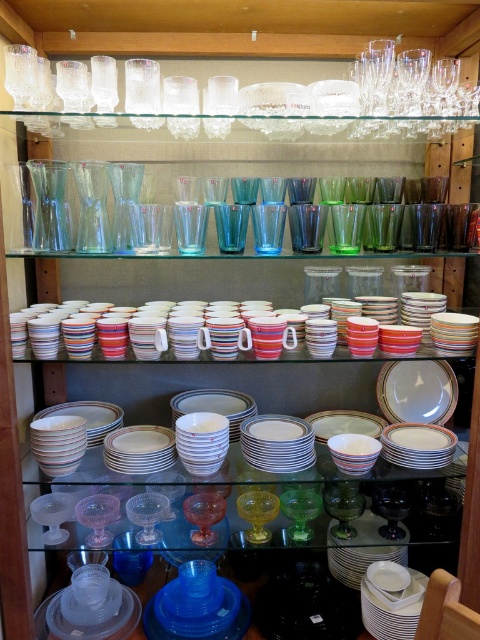
You are a delivery person who needs to place a new white glossy plate at center into the cabinet. The plate is 25 cm in diameter. Can you confirm if there is enough space on the bottom shelf to accommodate the plate without overlapping any existing items?

The white glossy plate at center is positioned 1.50 meters away from the camera, but the distance alone does not indicate space availability. Since the plate is 25 cm in diameter, you should check the physical dimensions of the bottom shelf and the arrangement of existing items to ensure there is sufficient space.